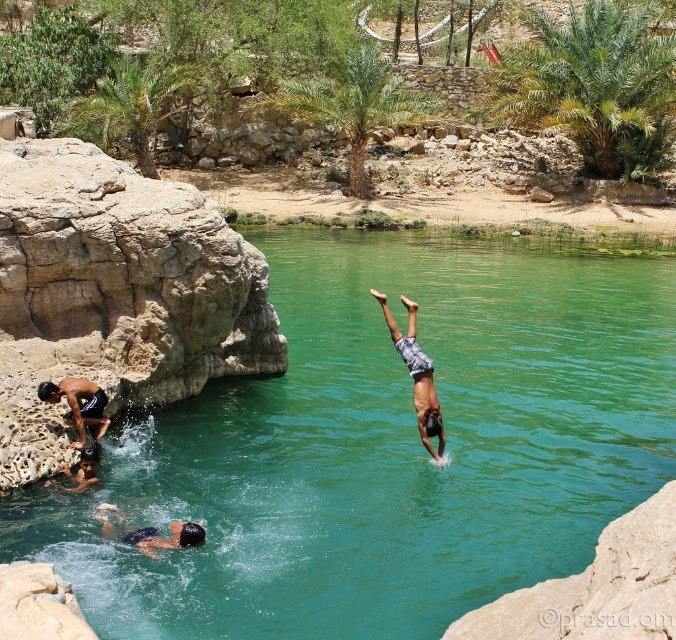
Does green smooth water at center have a lesser width compared to dark blue shorts at left?

In fact, green smooth water at center might be wider than dark blue shorts at left.

Is green smooth water at center closer to camera compared to dark blue shorts at left?

That is True.

Is point (564, 548) positioned after point (91, 419)?

No, (564, 548) is in front of (91, 419).

The height and width of the screenshot is (640, 676). I want to click on green smooth water at center, so click(x=383, y=445).

Can you confirm if green smooth water at center is taller than dark blue swim trunks at lower left?

Yes.

The image size is (676, 640). Identify the location of green smooth water at center. (383, 445).

At what (x,y) coordinates should I click in order to perform the action: click on green smooth water at center. Please return your answer as a coordinate pair (x, y). This screenshot has width=676, height=640. Looking at the image, I should click on (383, 445).

Is plaid shorts at center wider than dark blue swim trunks at lower left?

Yes.

Can you confirm if plaid shorts at center is bigger than dark blue swim trunks at lower left?

Yes.

Which is in front, point (397, 337) or point (76, 476)?

Point (76, 476) is in front.

The height and width of the screenshot is (640, 676). What are the coordinates of `plaid shorts at center` in the screenshot? It's located at (416, 374).